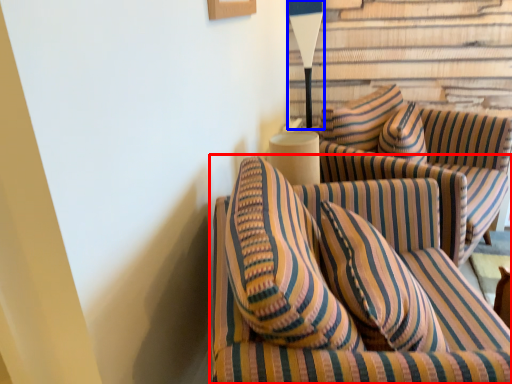
Question: Which point is closer to the camera, studio couch (highlighted by a red box) or table lamp (highlighted by a blue box)?

Choices:
 (A) studio couch
 (B) table lamp

Answer: (A)